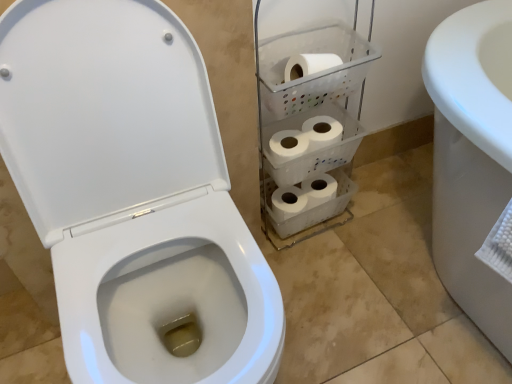
Question: Is white plastic shelf at center positioned before white glossy toilet at left?

Choices:
 (A) yes
 (B) no

Answer: (B)

Question: From the image's perspective, is white plastic shelf at center under white glossy toilet at left?

Choices:
 (A) no
 (B) yes

Answer: (A)

Question: From the image's perspective, would you say white plastic shelf at center is positioned over white glossy toilet at left?

Choices:
 (A) yes
 (B) no

Answer: (A)

Question: Is white plastic shelf at center outside of white glossy toilet at left?

Choices:
 (A) no
 (B) yes

Answer: (B)

Question: Considering the relative sizes of white plastic shelf at center and white glossy toilet at left in the image provided, is white plastic shelf at center bigger than white glossy toilet at left?

Choices:
 (A) no
 (B) yes

Answer: (A)

Question: Visually, is white plastic shelf at center positioned to the left or to the right of white matte toilet paper at center?

Choices:
 (A) right
 (B) left

Answer: (A)

Question: Considering their positions, is white plastic shelf at center located in front of or behind white matte toilet paper at center?

Choices:
 (A) front
 (B) behind

Answer: (A)

Question: From the image's perspective, relative to white matte toilet paper at center, is white plastic shelf at center above or below?

Choices:
 (A) above
 (B) below

Answer: (B)

Question: From their relative heights in the image, would you say white plastic shelf at center is taller or shorter than white matte toilet paper at center?

Choices:
 (A) tall
 (B) short

Answer: (A)

Question: Considering the positions of white glossy toilet at left and white plastic shelf at center in the image, is white glossy toilet at left taller or shorter than white plastic shelf at center?

Choices:
 (A) short
 (B) tall

Answer: (B)

Question: Would you say white glossy toilet at left is to the left or to the right of white plastic shelf at center in the picture?

Choices:
 (A) left
 (B) right

Answer: (A)

Question: In terms of size, does white glossy toilet at left appear bigger or smaller than white plastic shelf at center?

Choices:
 (A) big
 (B) small

Answer: (A)

Question: Is point (166, 162) closer or farther from the camera than point (287, 107)?

Choices:
 (A) farther
 (B) closer

Answer: (B)

Question: Considering their positions, is white matte toilet paper at center located in front of or behind white glossy toilet at left?

Choices:
 (A) front
 (B) behind

Answer: (B)

Question: Is white matte toilet paper at center bigger or smaller than white glossy toilet at left?

Choices:
 (A) small
 (B) big

Answer: (A)